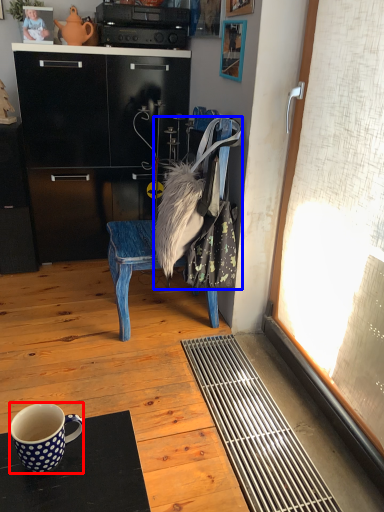
Question: Which of the following is the closest to the observer, coffee cup (highlighted by a red box) or handbag (highlighted by a blue box)?

Choices:
 (A) coffee cup
 (B) handbag

Answer: (A)